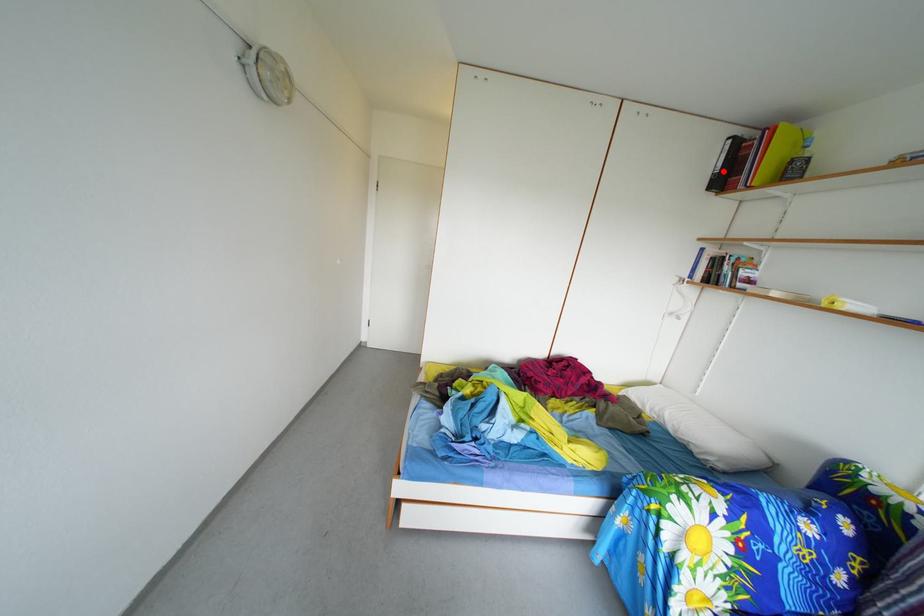
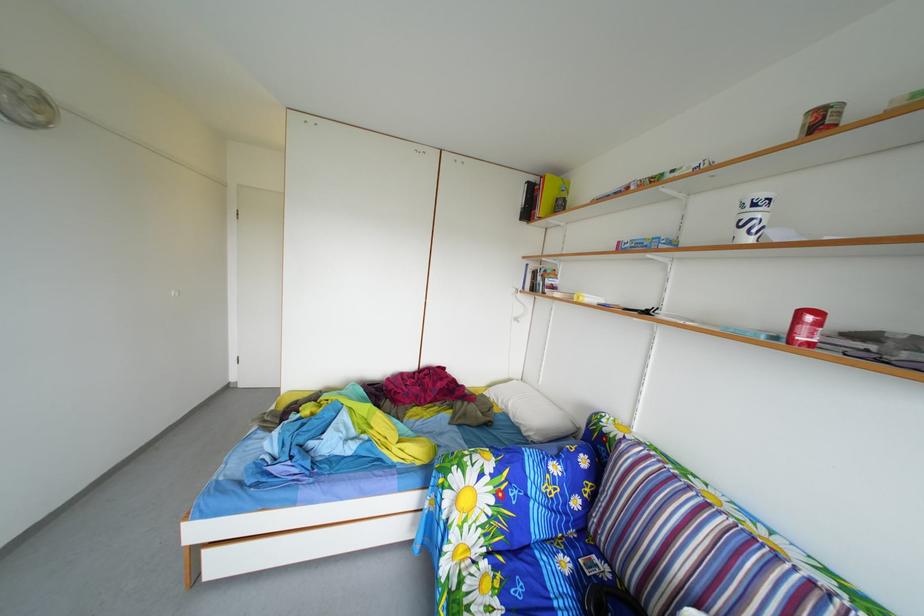
The point at the highlighted location is marked in the first image. Where is the corresponding point in the second image?

(530, 208)